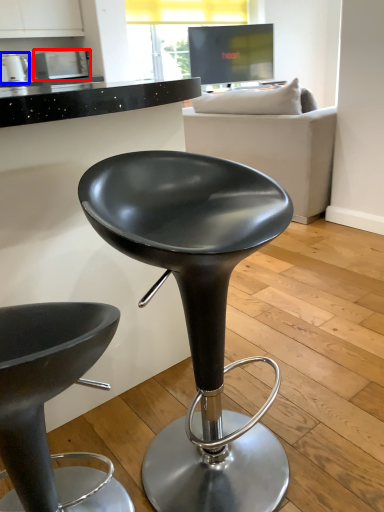
Question: Which object is closer to the camera taking this photo, appliance (highlighted by a red box) or appliance (highlighted by a blue box)?

Choices:
 (A) appliance
 (B) appliance

Answer: (B)